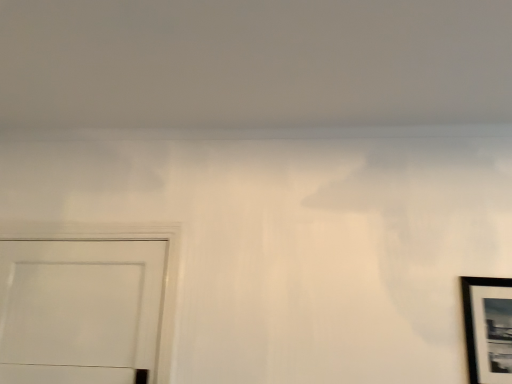
Image resolution: width=512 pixels, height=384 pixels. In order to click on black matte picture frame at lower right in this screenshot , I will do `click(487, 326)`.

The image size is (512, 384). What do you see at coordinates (487, 326) in the screenshot? I see `black matte picture frame at lower right` at bounding box center [487, 326].

Identify the location of black matte picture frame at lower right. (487, 326).